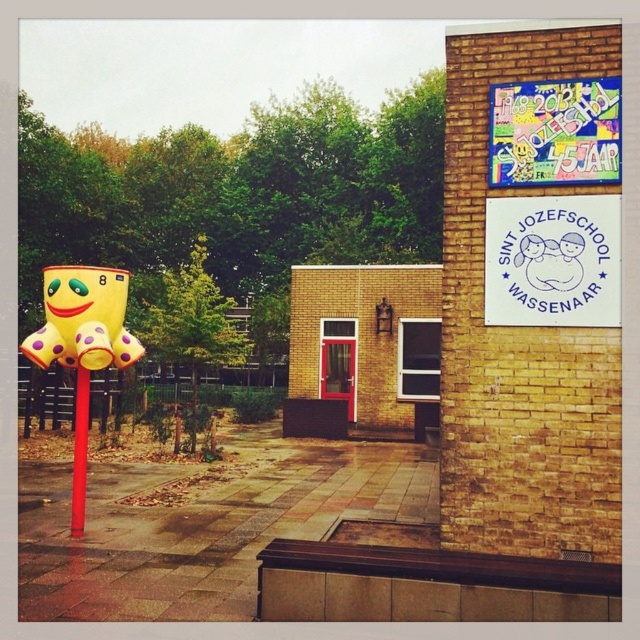
Between point (84, 371) and point (580, 236), which one is positioned behind?

Positioned behind is point (84, 371).

Between point (83, 385) and point (577, 237), which one is positioned in front?

Positioned in front is point (577, 237).

Does point (77, 385) come in front of point (564, 253)?

No, (77, 385) is further to viewer.

At what (x,y) coordinates should I click in order to perform the action: click on yellow rubber duck at left. Please return your answer as a coordinate pair (x, y). This screenshot has height=640, width=640. Looking at the image, I should click on (80, 451).

From the picture: How much distance is there between white paper sign at upper right and yellow rubber duck at left?

white paper sign at upper right is 4.89 meters from yellow rubber duck at left.

The image size is (640, 640). What do you see at coordinates (552, 260) in the screenshot? I see `white paper sign at upper right` at bounding box center [552, 260].

The height and width of the screenshot is (640, 640). I want to click on white paper sign at upper right, so click(552, 260).

I want to click on white paper sign at upper right, so click(552, 260).

Does yellow rubber toy at left appear on the left side of smooth white face at upper right?

Yes, yellow rubber toy at left is to the left of smooth white face at upper right.

Between point (120, 355) and point (570, 257), which one is positioned behind?

Positioned behind is point (120, 355).

Describe the element at coordinates (83, 320) in the screenshot. I see `yellow rubber toy at left` at that location.

Identify the location of yellow rubber toy at left. (x=83, y=320).